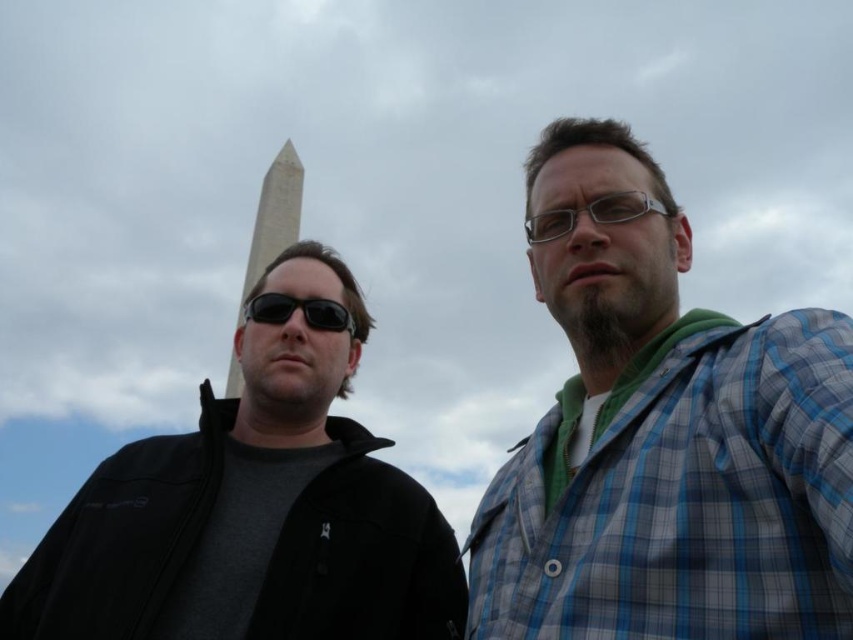
Question: Based on their relative distances, which object is nearer to the black matte jacket at left?

Choices:
 (A) blue plaid shirt at center
 (B) black matte sunglasses at center

Answer: (B)

Question: Which is nearer to the black matte sunglasses at center?

Choices:
 (A) blue plaid shirt at center
 (B) black matte jacket at left

Answer: (B)

Question: Which point is closer to the camera?

Choices:
 (A) (509, 561)
 (B) (329, 305)

Answer: (A)

Question: Is black matte jacket at left positioned at the back of black matte sunglasses at center?

Choices:
 (A) no
 (B) yes

Answer: (A)

Question: Does black matte jacket at left lie behind black matte sunglasses at center?

Choices:
 (A) yes
 (B) no

Answer: (B)

Question: In this image, where is blue plaid shirt at center located relative to black matte sunglasses at center?

Choices:
 (A) above
 (B) below

Answer: (B)